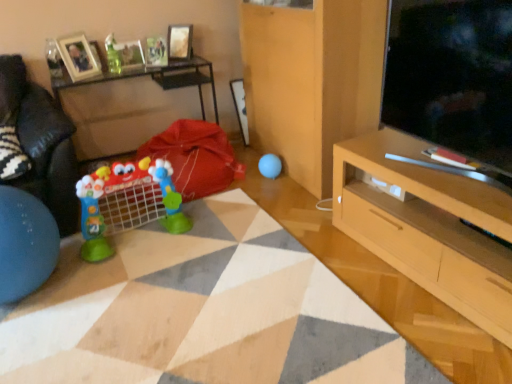
Identify the location of unoccupied area in front of plastic toy at center, the first toy when ordered from bottom to top. (134, 278).